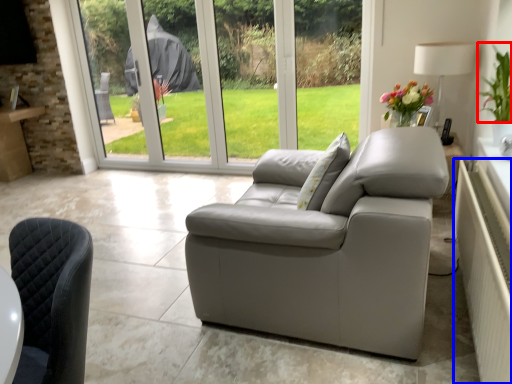
Question: Which object appears farthest to the camera in this image, plant (highlighted by a red box) or radiator (highlighted by a blue box)?

Choices:
 (A) plant
 (B) radiator

Answer: (A)